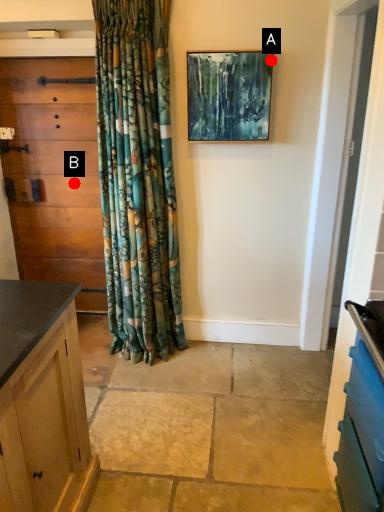
Question: Two points are circled on the image, labeled by A and B beside each circle. Which point appears farthest from the camera in this image?

Choices:
 (A) A is further
 (B) B is further

Answer: (B)